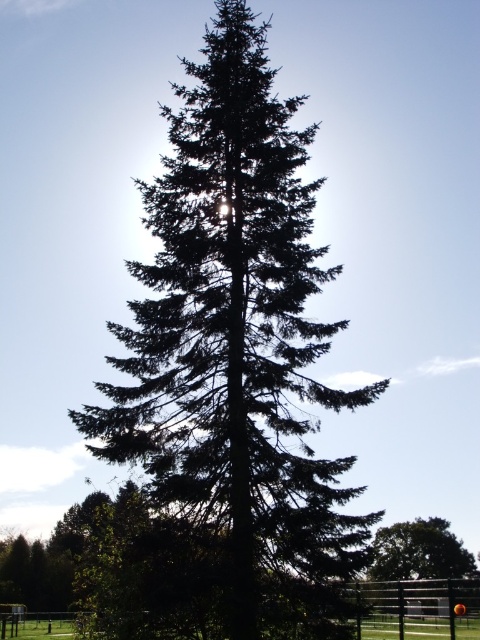
Question: Considering the relative positions of green needle-like at center and green matte tree at lower right in the image provided, where is green needle-like at center located with respect to green matte tree at lower right?

Choices:
 (A) left
 (B) right

Answer: (A)

Question: Can you confirm if green needle-like at center is positioned above green matte tree at lower right?

Choices:
 (A) no
 (B) yes

Answer: (B)

Question: Does green needle-like at center have a lesser width compared to green matte tree at lower right?

Choices:
 (A) yes
 (B) no

Answer: (B)